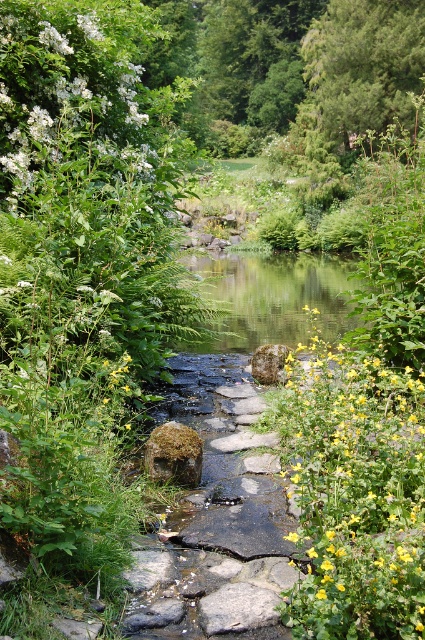
Question: Is yellow matte flower at center-right smaller than white fluffy flowers at upper left?

Choices:
 (A) no
 (B) yes

Answer: (B)

Question: Which point is closer to the camera?

Choices:
 (A) white fluffy flowers at upper left
 (B) yellow matte flower at center-right

Answer: (B)

Question: Is yellow matte flower at center-right to the right of white fluffy flowers at upper left from the viewer's perspective?

Choices:
 (A) no
 (B) yes

Answer: (B)

Question: Can you confirm if yellow matte flower at center-right is smaller than white fluffy flowers at upper left?

Choices:
 (A) yes
 (B) no

Answer: (A)